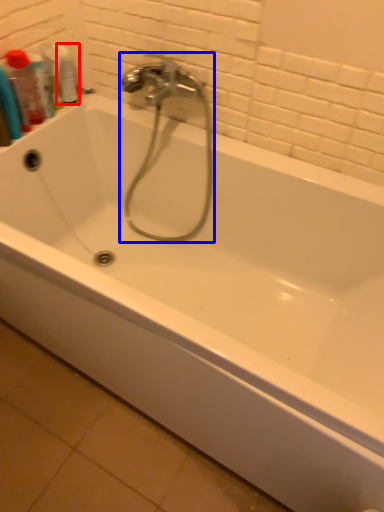
Question: Which of the following is the closest to the observer, mouthwash (highlighted by a red box) or faucet (highlighted by a blue box)?

Choices:
 (A) mouthwash
 (B) faucet

Answer: (B)